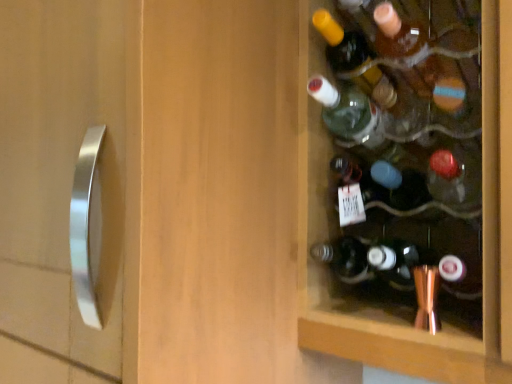
Question: Is translucent amber glass bottle at upper right, the 1th bottle in the top-to-bottom sequence, bigger than translucent glass bottle at center, placed as the 1th bottle when sorted from bottom to top?

Choices:
 (A) yes
 (B) no

Answer: (B)

Question: Is translucent amber glass bottle at upper right, the fourth bottle from the bottom, taller than translucent glass bottle at center, which appears as the fourth bottle when viewed from the top?

Choices:
 (A) yes
 (B) no

Answer: (B)

Question: From a real-world perspective, is translucent amber glass bottle at upper right, the 1th bottle in the top-to-bottom sequence, located beneath translucent glass bottle at center, which appears as the fourth bottle when viewed from the top?

Choices:
 (A) no
 (B) yes

Answer: (A)

Question: Considering the relative sizes of translucent amber glass bottle at upper right, the 1th bottle in the top-to-bottom sequence, and translucent glass bottle at center, which appears as the fourth bottle when viewed from the top, in the image provided, is translucent amber glass bottle at upper right, the 1th bottle in the top-to-bottom sequence, wider than translucent glass bottle at center, which appears as the fourth bottle when viewed from the top,?

Choices:
 (A) yes
 (B) no

Answer: (B)

Question: Is translucent amber glass bottle at upper right, the fourth bottle from the bottom, thinner than translucent glass bottle at center, which appears as the fourth bottle when viewed from the top?

Choices:
 (A) no
 (B) yes

Answer: (B)

Question: Considering the positions of green glass bottle at upper right, the 2th bottle positioned from the bottom, and translucent glass bottle at upper right, the third bottle ordered from the bottom, in the image, is green glass bottle at upper right, the 2th bottle positioned from the bottom, taller or shorter than translucent glass bottle at upper right, the third bottle ordered from the bottom,?

Choices:
 (A) tall
 (B) short

Answer: (A)

Question: Is green glass bottle at upper right, acting as the third bottle starting from the top, in front of or behind translucent glass bottle at upper right, the third bottle ordered from the bottom, in the image?

Choices:
 (A) front
 (B) behind

Answer: (A)

Question: Is green glass bottle at upper right, the 2th bottle positioned from the bottom, inside or outside of translucent glass bottle at upper right, arranged as the 2th bottle when viewed from the top?

Choices:
 (A) outside
 (B) inside

Answer: (A)

Question: From a real-world perspective, is green glass bottle at upper right, acting as the third bottle starting from the top, above or below translucent glass bottle at upper right, the third bottle ordered from the bottom?

Choices:
 (A) below
 (B) above

Answer: (A)

Question: Considering the positions of point (333, 130) and point (420, 200), is point (333, 130) closer or farther from the camera than point (420, 200)?

Choices:
 (A) farther
 (B) closer

Answer: (A)

Question: Is green glass bottle at upper right, acting as the third bottle starting from the top, bigger or smaller than translucent glass bottle at center, which appears as the fourth bottle when viewed from the top?

Choices:
 (A) small
 (B) big

Answer: (A)

Question: In terms of height, does green glass bottle at upper right, the 2th bottle positioned from the bottom, look taller or shorter compared to translucent glass bottle at center, placed as the 1th bottle when sorted from bottom to top?

Choices:
 (A) short
 (B) tall

Answer: (A)

Question: Visually, is green glass bottle at upper right, the 2th bottle positioned from the bottom, positioned to the left or to the right of translucent glass bottle at center, which appears as the fourth bottle when viewed from the top?

Choices:
 (A) right
 (B) left

Answer: (B)

Question: Based on their sizes in the image, would you say translucent amber glass bottle at upper right, the fourth bottle from the bottom, is bigger or smaller than translucent glass bottle at center, which appears as the fourth bottle when viewed from the top?

Choices:
 (A) small
 (B) big

Answer: (A)

Question: Looking at their shapes, would you say translucent amber glass bottle at upper right, the 1th bottle in the top-to-bottom sequence, is wider or thinner than translucent glass bottle at center, placed as the 1th bottle when sorted from bottom to top?

Choices:
 (A) wide
 (B) thin

Answer: (B)